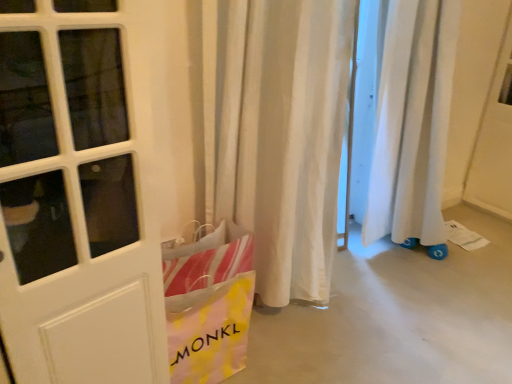
Identify the location of free spot above yellow and pink plastic bag at lower left (from a real-world perspective). The width and height of the screenshot is (512, 384). (215, 239).